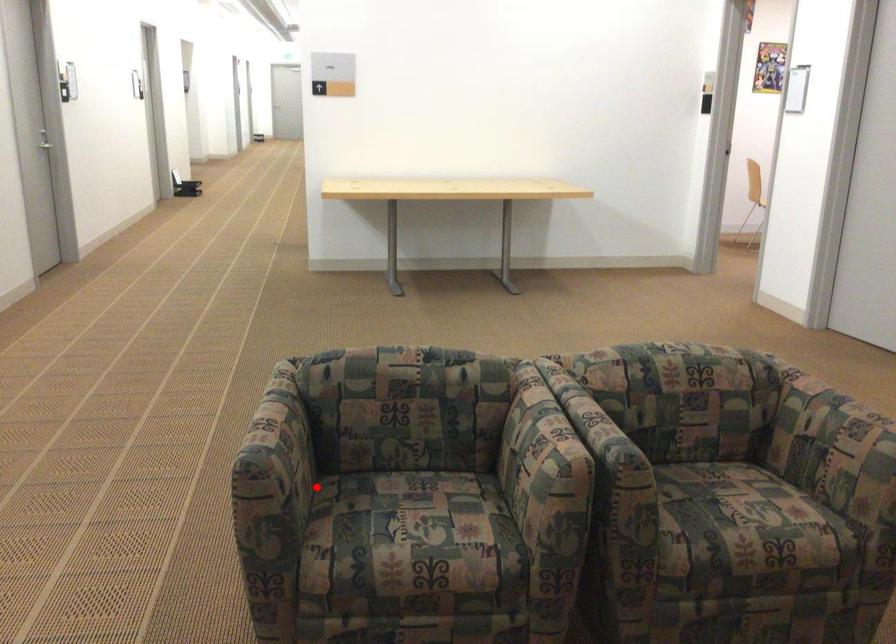
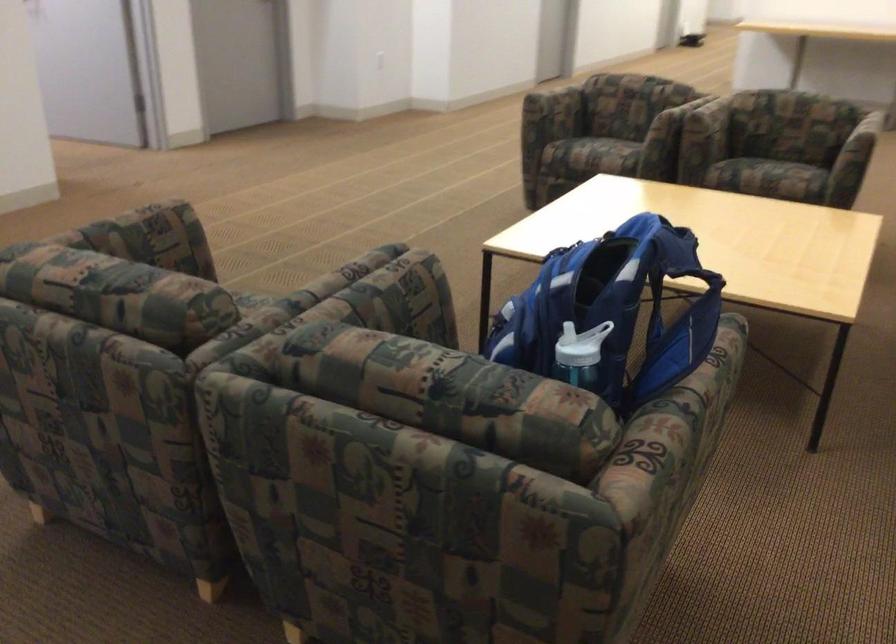
Locate, in the second image, the point that corresponds to the highlighted location in the first image.

(554, 108)